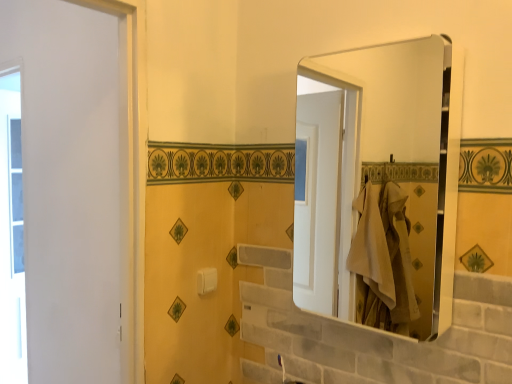
Question: Is white plastic towel bar at center a part of metallic silver mirror at upper right?

Choices:
 (A) yes
 (B) no

Answer: (B)

Question: Does metallic silver mirror at upper right have a greater height compared to white plastic towel bar at center?

Choices:
 (A) yes
 (B) no

Answer: (A)

Question: Is metallic silver mirror at upper right touching white plastic towel bar at center?

Choices:
 (A) no
 (B) yes

Answer: (A)

Question: Can you confirm if metallic silver mirror at upper right is thinner than white plastic towel bar at center?

Choices:
 (A) no
 (B) yes

Answer: (A)

Question: Is metallic silver mirror at upper right positioned behind white plastic towel bar at center?

Choices:
 (A) yes
 (B) no

Answer: (B)

Question: Does metallic silver mirror at upper right have a larger size compared to white plastic towel bar at center?

Choices:
 (A) no
 (B) yes

Answer: (B)

Question: From a real-world perspective, does white plastic towel bar at center stand above metallic silver mirror at upper right?

Choices:
 (A) no
 (B) yes

Answer: (A)

Question: Is white plastic towel bar at center facing away from metallic silver mirror at upper right?

Choices:
 (A) yes
 (B) no

Answer: (B)

Question: Considering the relative positions of white plastic towel bar at center and metallic silver mirror at upper right in the image provided, is white plastic towel bar at center in front of metallic silver mirror at upper right?

Choices:
 (A) yes
 (B) no

Answer: (B)

Question: Considering the relative sizes of white plastic towel bar at center and metallic silver mirror at upper right in the image provided, is white plastic towel bar at center shorter than metallic silver mirror at upper right?

Choices:
 (A) no
 (B) yes

Answer: (B)

Question: From a real-world perspective, is white plastic towel bar at center positioned under metallic silver mirror at upper right based on gravity?

Choices:
 (A) yes
 (B) no

Answer: (A)

Question: Is white plastic towel bar at center oriented towards metallic silver mirror at upper right?

Choices:
 (A) yes
 (B) no

Answer: (B)

Question: Would you say white plastic towel bar at center is part of transparent glass window at left's contents?

Choices:
 (A) yes
 (B) no

Answer: (B)